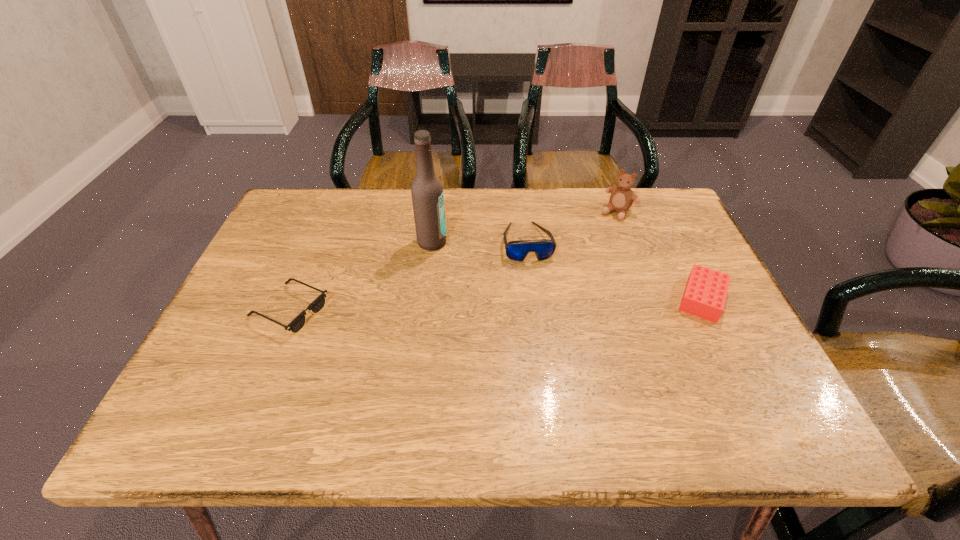
This screenshot has width=960, height=540. Identify the location of the left sunglasses. (317, 305).

The image size is (960, 540). What are the coordinates of `the nearer sunglasses` in the screenshot? It's located at [317, 305].

Where is `Lego`? This screenshot has height=540, width=960. Lego is located at coordinates (705, 293).

Image resolution: width=960 pixels, height=540 pixels. I want to click on the fourth tallest object, so (705, 293).

At what (x,y) coordinates should I click in order to perform the action: click on the fourth object from right to left. Please return your answer as a coordinate pair (x, y). The height and width of the screenshot is (540, 960). Looking at the image, I should click on (427, 194).

In order to click on beer bottle in this screenshot , I will do `click(427, 194)`.

The width and height of the screenshot is (960, 540). I want to click on the second tallest object, so [621, 199].

Image resolution: width=960 pixels, height=540 pixels. In order to click on the farthest object in this screenshot , I will do (621, 199).

You are a GUI agent. You are given a task and a screenshot of the screen. Output one action in this format:
    pyautogui.click(x=<x>, y=<y>)
    Task: Click on the right sunglasses
    The width and height of the screenshot is (960, 540).
    Given the screenshot: What is the action you would take?
    pyautogui.click(x=517, y=250)

Locate an element on the screen. Image resolution: width=960 pixels, height=540 pixels. the taller sunglasses is located at coordinates (517, 250).